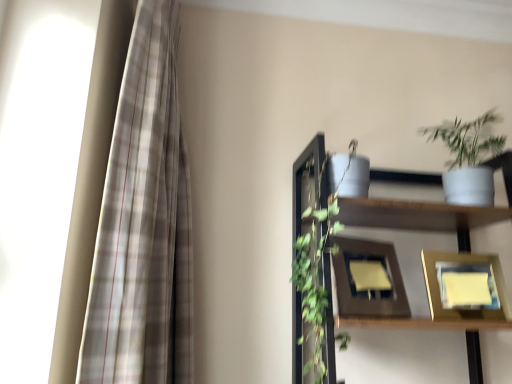
Question: Could plaid fabric curtain at left be considered to be inside white matte pot at upper right?

Choices:
 (A) no
 (B) yes

Answer: (A)

Question: Is white matte pot at upper right far away from plaid fabric curtain at left?

Choices:
 (A) no
 (B) yes

Answer: (A)

Question: Does white matte pot at upper right have a greater width compared to plaid fabric curtain at left?

Choices:
 (A) yes
 (B) no

Answer: (B)

Question: From the image's perspective, would you say white matte pot at upper right is shown under plaid fabric curtain at left?

Choices:
 (A) yes
 (B) no

Answer: (B)

Question: Is white matte pot at upper right closer to camera compared to plaid fabric curtain at left?

Choices:
 (A) yes
 (B) no

Answer: (B)

Question: Relative to white matte shelf at upper right, is gold metallic picture frame at lower right, positioned as the second picture frame in left-to-right order, in front or behind?

Choices:
 (A) front
 (B) behind

Answer: (B)

Question: From the image's perspective, is gold metallic picture frame at lower right, which is the first picture frame in right-to-left order, above or below white matte shelf at upper right?

Choices:
 (A) below
 (B) above

Answer: (A)

Question: Is gold metallic picture frame at lower right, which is the first picture frame in right-to-left order, wider or thinner than white matte shelf at upper right?

Choices:
 (A) wide
 (B) thin

Answer: (B)

Question: In terms of height, does gold metallic picture frame at lower right, which is the first picture frame in right-to-left order, look taller or shorter compared to white matte shelf at upper right?

Choices:
 (A) tall
 (B) short

Answer: (B)

Question: In the image, is gold metallic picture frame at lower right, which is the first picture frame in right-to-left order, on the left side or the right side of wooden picture frame at center, the first picture frame when ordered from left to right?

Choices:
 (A) left
 (B) right

Answer: (B)

Question: From the image's perspective, relative to wooden picture frame at center, the first picture frame when ordered from left to right, is gold metallic picture frame at lower right, which is the first picture frame in right-to-left order, above or below?

Choices:
 (A) below
 (B) above

Answer: (A)

Question: Considering the positions of gold metallic picture frame at lower right, which is the first picture frame in right-to-left order, and wooden picture frame at center, positioned as the second picture frame in right-to-left order, in the image, is gold metallic picture frame at lower right, which is the first picture frame in right-to-left order, taller or shorter than wooden picture frame at center, positioned as the second picture frame in right-to-left order,?

Choices:
 (A) short
 (B) tall

Answer: (A)

Question: Is gold metallic picture frame at lower right, which is the first picture frame in right-to-left order, bigger or smaller than wooden picture frame at center, positioned as the second picture frame in right-to-left order?

Choices:
 (A) big
 (B) small

Answer: (B)

Question: Is wooden picture frame at center, the first picture frame when ordered from left to right, inside or outside of white matte shelf at upper right?

Choices:
 (A) outside
 (B) inside

Answer: (B)

Question: From a real-world perspective, is wooden picture frame at center, the first picture frame when ordered from left to right, physically located above or below white matte shelf at upper right?

Choices:
 (A) above
 (B) below

Answer: (B)